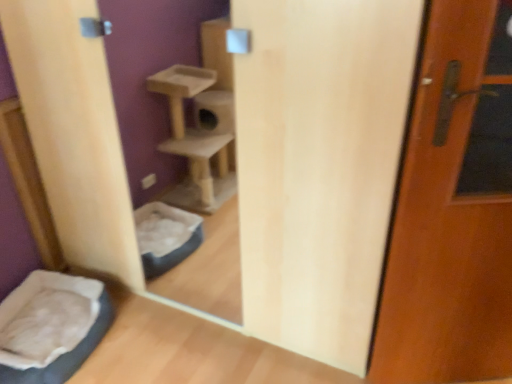
Question: Based on their sizes in the image, would you say soft white fabric at lower left is bigger or smaller than brown wooden door at right?

Choices:
 (A) small
 (B) big

Answer: (B)

Question: Considering the positions of soft white fabric at lower left and brown wooden door at right in the image, is soft white fabric at lower left taller or shorter than brown wooden door at right?

Choices:
 (A) short
 (B) tall

Answer: (A)

Question: From a real-world perspective, relative to brown wooden door at right, is soft white fabric at lower left vertically above or below?

Choices:
 (A) above
 (B) below

Answer: (B)

Question: From the image's perspective, is brown wooden door at right above or below soft white fabric at lower left?

Choices:
 (A) above
 (B) below

Answer: (A)

Question: Relative to soft white fabric at lower left, is brown wooden door at right in front or behind?

Choices:
 (A) behind
 (B) front

Answer: (B)

Question: Is brown wooden door at right taller or shorter than soft white fabric at lower left?

Choices:
 (A) short
 (B) tall

Answer: (B)

Question: Visually, is brown wooden door at right positioned to the left or to the right of soft white fabric at lower left?

Choices:
 (A) left
 (B) right

Answer: (B)